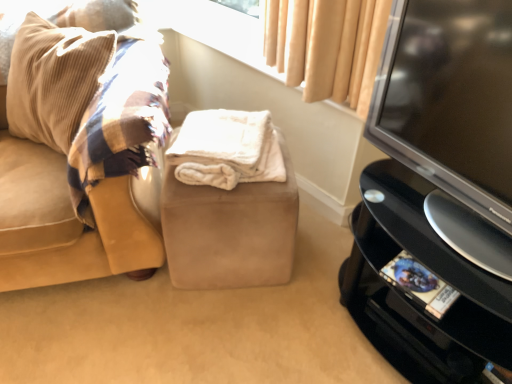
Where is `free space in front of suede beige stool at center`? free space in front of suede beige stool at center is located at coordinates (226, 329).